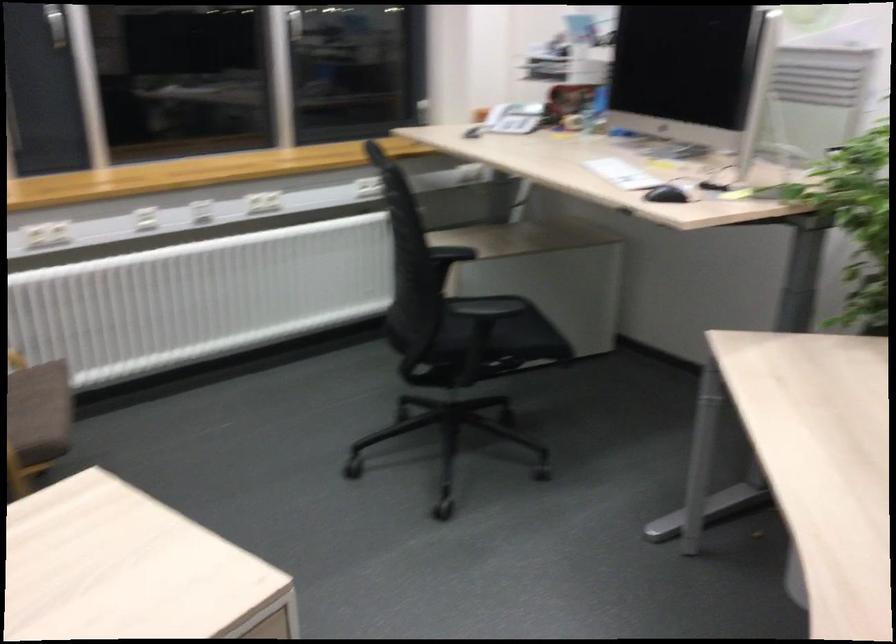
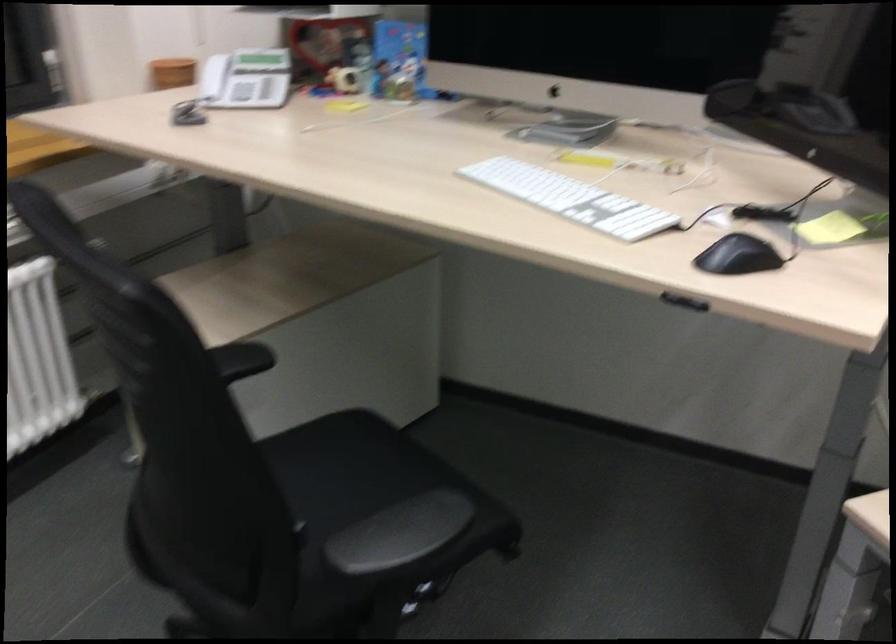
Locate, in the second image, the point that corresponds to pixel 510 319 in the first image.

(376, 483)